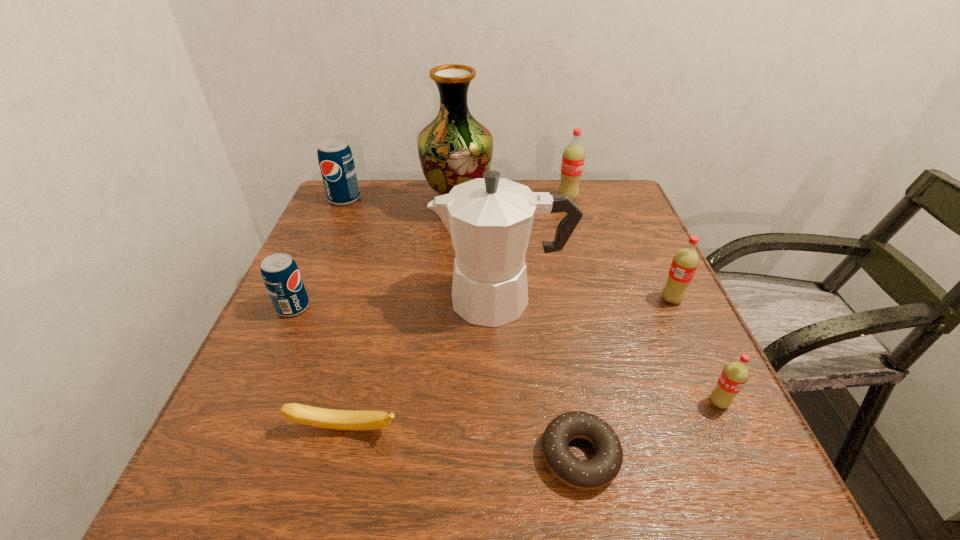
At what (x,y) coordinates should I click in order to perform the action: click on vacant space at the far edge of the desktop. Please return your answer as a coordinate pair (x, y). This screenshot has height=540, width=960. Looking at the image, I should click on (415, 207).

In the image, there is a desktop. Find the location of `vacant space at the near edge`. vacant space at the near edge is located at coordinates (444, 456).

This screenshot has height=540, width=960. In the image, there is a desktop. Identify the location of vacant region at the right edge. (597, 263).

Locate an element on the screen. free space at the far left corner of the desktop is located at coordinates (384, 212).

Locate an element on the screen. The height and width of the screenshot is (540, 960). vacant space at the near left corner is located at coordinates (291, 476).

Where is `vacant position at the far right corner of the desktop`? This screenshot has height=540, width=960. vacant position at the far right corner of the desktop is located at coordinates (613, 193).

In the image, there is a desktop. Identify the location of vacant area at the near right corner. The height and width of the screenshot is (540, 960). (748, 509).

This screenshot has height=540, width=960. I want to click on empty space between the nearer blue pop and the leftmost red soda, so click(430, 253).

At what (x,y) coordinates should I click in order to perform the action: click on free space between the vase and the second nearest red soda. Please return your answer as a coordinate pair (x, y). Looking at the image, I should click on (564, 254).

You are a GUI agent. You are given a task and a screenshot of the screen. Output one action in this format:
    pyautogui.click(x=<x>, y=<y>)
    Task: Click on the free space between the tallest object and the doughnut
    The image size is (960, 540).
    Given the screenshot: What is the action you would take?
    pyautogui.click(x=518, y=332)